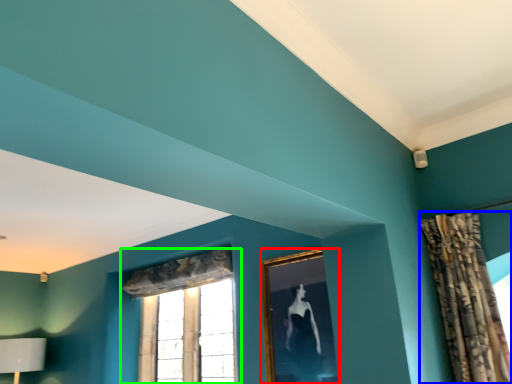
Question: Which is farther away from picture frame (highlighted by a red box)? curtain (highlighted by a blue box) or window (highlighted by a green box)?

Choices:
 (A) curtain
 (B) window

Answer: (B)